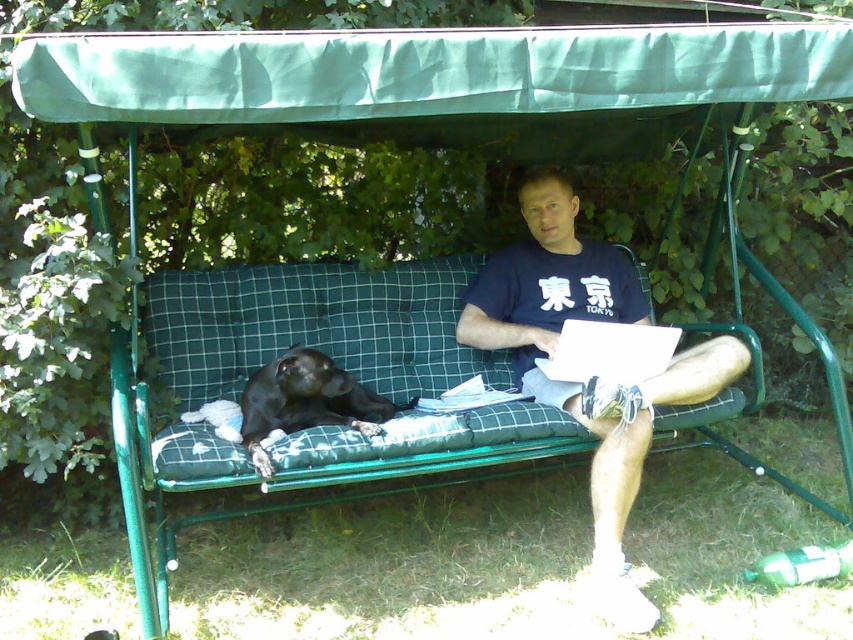
What is the 2D coordinate of the green fabric canopy at upper center in the image?

The green fabric canopy at upper center is located at the coordinate point of (424,72).

Consider the image. You are standing in a park and see a man sitting on a green metal swing bench with a canopy. There is a black dog lying next to him. A point labeled with coordinates is shown in the image. What object is located at the coordinates point (424, 72)?

The coordinates point (424, 72) marks the green fabric canopy at upper center.